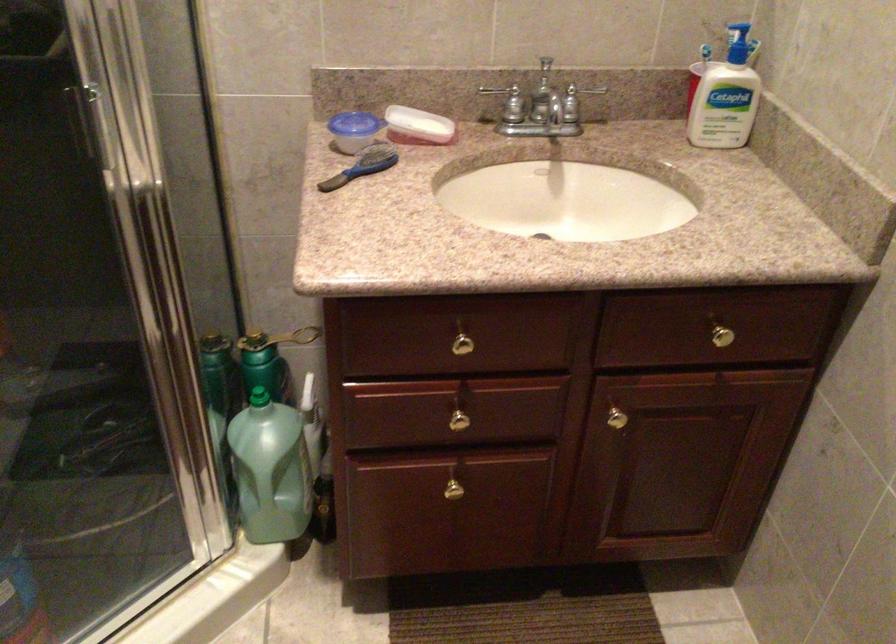
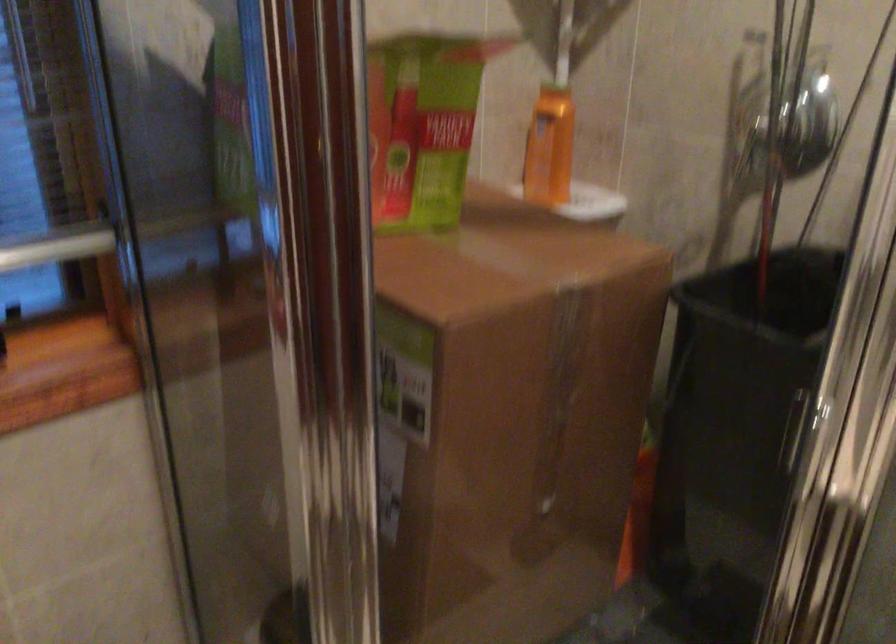
Question: The camera is either moving clockwise (left) or counter-clockwise (right) around the object. The first image is from the beginning of the video and the second image is from the end. Is the camera moving left or right when shooting the video?

Choices:
 (A) Left
 (B) Right

Answer: (B)